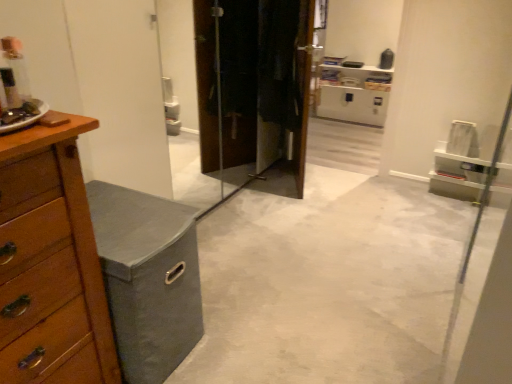
Question: Is wooden chest of drawers at left in contact with gray fabric storage bin at left?

Choices:
 (A) yes
 (B) no

Answer: (B)

Question: Considering the relative positions of wooden chest of drawers at left and gray fabric storage bin at left in the image provided, is wooden chest of drawers at left to the left of gray fabric storage bin at left from the viewer's perspective?

Choices:
 (A) yes
 (B) no

Answer: (A)

Question: Is there a large distance between wooden chest of drawers at left and gray fabric storage bin at left?

Choices:
 (A) no
 (B) yes

Answer: (B)

Question: Considering the relative sizes of wooden chest of drawers at left and gray fabric storage bin at left in the image provided, is wooden chest of drawers at left taller than gray fabric storage bin at left?

Choices:
 (A) no
 (B) yes

Answer: (B)

Question: Does wooden chest of drawers at left lie behind gray fabric storage bin at left?

Choices:
 (A) yes
 (B) no

Answer: (B)

Question: Considering the positions of wooden chest of drawers at left and gray fabric storage bin at left in the image, is wooden chest of drawers at left taller or shorter than gray fabric storage bin at left?

Choices:
 (A) tall
 (B) short

Answer: (A)

Question: Choose the correct answer: Is wooden chest of drawers at left inside gray fabric storage bin at left or outside it?

Choices:
 (A) inside
 (B) outside

Answer: (B)

Question: Looking at their shapes, would you say wooden chest of drawers at left is wider or thinner than gray fabric storage bin at left?

Choices:
 (A) thin
 (B) wide

Answer: (A)

Question: Considering the positions of wooden chest of drawers at left and gray fabric storage bin at left in the image, is wooden chest of drawers at left bigger or smaller than gray fabric storage bin at left?

Choices:
 (A) big
 (B) small

Answer: (A)

Question: Relative to wooden chest of drawers at left, is wooden vanity at left in front or behind?

Choices:
 (A) front
 (B) behind

Answer: (B)

Question: Which is correct: wooden vanity at left is inside wooden chest of drawers at left, or outside of it?

Choices:
 (A) inside
 (B) outside

Answer: (B)

Question: Does point (200, 331) appear closer or farther from the camera than point (50, 236)?

Choices:
 (A) closer
 (B) farther

Answer: (B)

Question: Looking at their shapes, would you say wooden vanity at left is wider or thinner than wooden chest of drawers at left?

Choices:
 (A) wide
 (B) thin

Answer: (A)

Question: Does point (453, 253) appear closer or farther from the camera than point (97, 208)?

Choices:
 (A) closer
 (B) farther

Answer: (B)

Question: Considering their positions, is gray fabric storage bin at left located in front of or behind wooden vanity at left?

Choices:
 (A) behind
 (B) front

Answer: (B)